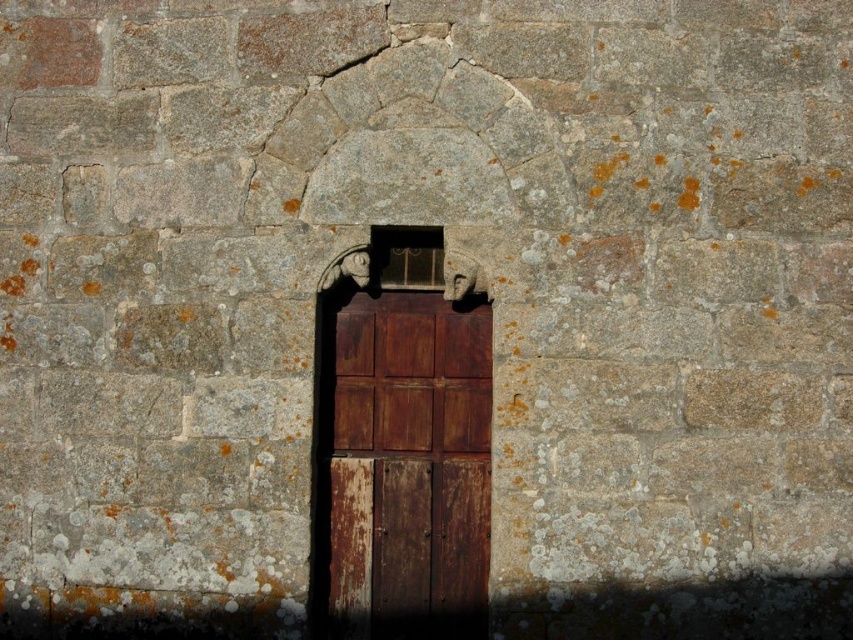
Question: Which point is closer to the camera?

Choices:
 (A) rusty wood door at center
 (B) matte metal window at center

Answer: (B)

Question: Does rusty wood door at center have a smaller size compared to matte metal window at center?

Choices:
 (A) yes
 (B) no

Answer: (B)

Question: Can you confirm if rusty wood door at center is positioned above matte metal window at center?

Choices:
 (A) yes
 (B) no

Answer: (B)

Question: Which object appears farthest from the camera in this image?

Choices:
 (A) matte metal window at center
 (B) rusty wood door at center

Answer: (B)

Question: Where is rusty wood door at center located in relation to matte metal window at center in the image?

Choices:
 (A) left
 (B) right

Answer: (B)